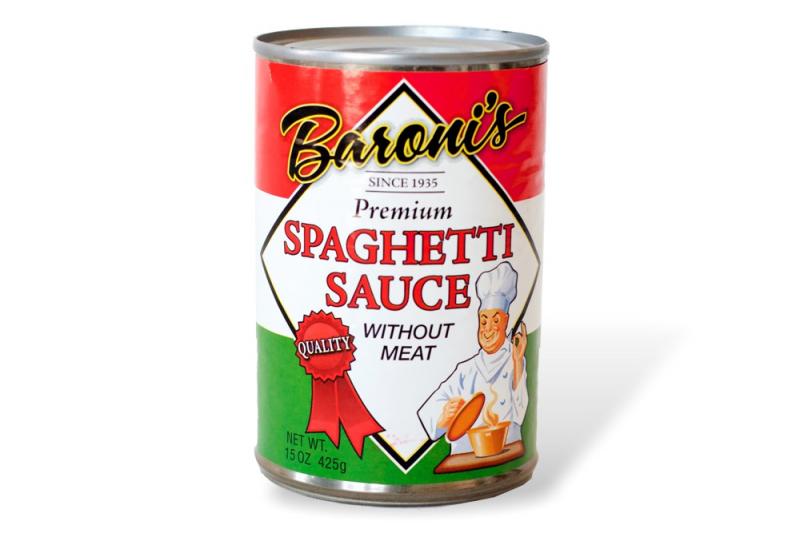
At what (x,y) coordinates should I click in order to perform the action: click on pot for lid. Please return your answer as a coordinate pair (x, y). The height and width of the screenshot is (533, 800). Looking at the image, I should click on (474, 416).